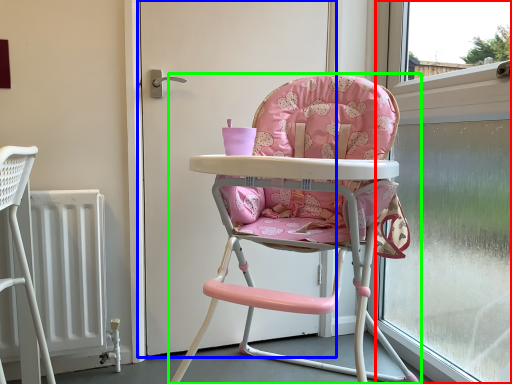
Question: Which object is positioned closest to window screen (highlighted by a red box)? Select from screen door (highlighted by a blue box) and chair (highlighted by a green box).

Choices:
 (A) screen door
 (B) chair

Answer: (B)